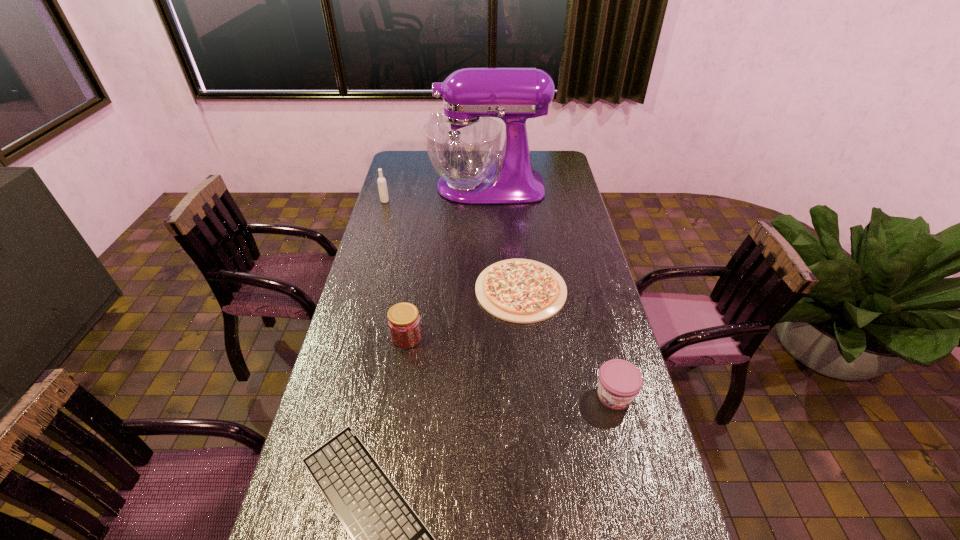
I want to click on pizza present at the right edge, so click(523, 291).

Locate an element on the screen. object that is at the far right corner is located at coordinates (463, 144).

The image size is (960, 540). Identify the location of vacant space at the left edge of the desktop. (357, 300).

Find the location of `free space at the right edge of the desktop`. free space at the right edge of the desktop is located at coordinates (588, 255).

Where is `free space between the fourth tallest object and the pizza`? Image resolution: width=960 pixels, height=540 pixels. free space between the fourth tallest object and the pizza is located at coordinates (567, 343).

Identify the location of empty space that is in between the second shortest object and the fifth shortest object. (453, 246).

The height and width of the screenshot is (540, 960). Identify the location of empty location between the tallest object and the second tallest object. (436, 194).

What are the coordinates of `free space between the pizza and the farther jam` in the screenshot? It's located at (464, 314).

In order to click on free space between the vodka and the mixer in this screenshot , I will do `click(436, 194)`.

Identify the location of free area in between the mixer and the pizza. The height and width of the screenshot is (540, 960). (504, 238).